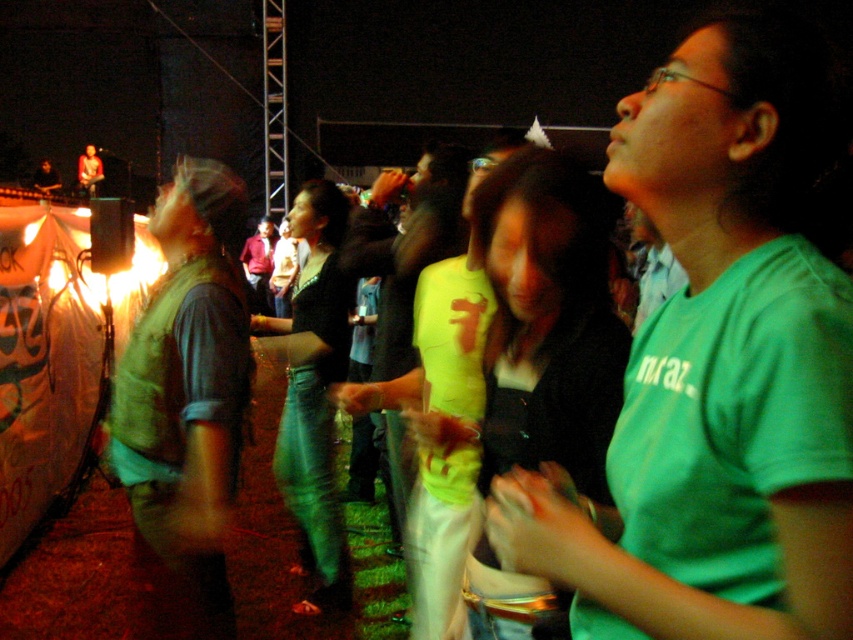
Question: Is green matte shirt at upper right wider than jeans at center?

Choices:
 (A) yes
 (B) no

Answer: (B)

Question: Can you confirm if green matte vest at left is positioned below jeans at center?

Choices:
 (A) no
 (B) yes

Answer: (A)

Question: Which point is farther to the camera?

Choices:
 (A) (195, 476)
 (B) (309, 248)

Answer: (B)

Question: Which of the following is the closest to the observer?

Choices:
 (A) green matte shirt at upper right
 (B) green matte vest at left
 (C) jeans at center

Answer: (A)

Question: Which point is farther to the camera?

Choices:
 (A) (325, 353)
 (B) (735, 362)
 (C) (196, 234)

Answer: (A)

Question: From the image, what is the correct spatial relationship of green matte vest at left in relation to jeans at center?

Choices:
 (A) right
 (B) left

Answer: (B)